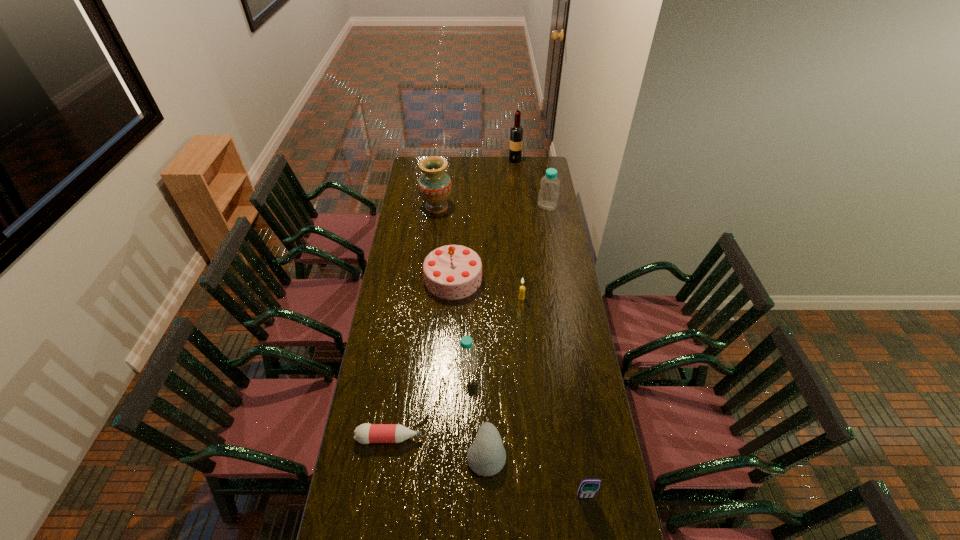
Identify which object is the closest to the nearest object. Please provide its 2D coordinates. Your answer should be formatted as a tuple, i.e. [(x, y)], where the tuple contains the x and y coordinates of a point satisfying the conditions above.

[(486, 456)]

Point out which object is positioned as the nearest to the candle. Please provide its 2D coordinates. Your answer should be formatted as a tuple, i.e. [(x, y)], where the tuple contains the x and y coordinates of a point satisfying the conditions above.

[(451, 272)]

Image resolution: width=960 pixels, height=540 pixels. I want to click on bottle that is the second nearest to the birthday cake, so click(548, 195).

This screenshot has height=540, width=960. What are the coordinates of `the third closest bottle to the birthday cake` in the screenshot? It's located at (x=366, y=433).

I want to click on vacant space that satisfies the following two spatial constraints: 1. on the front side of the candle; 2. with the cap open on the leftmost bottle, so click(x=534, y=438).